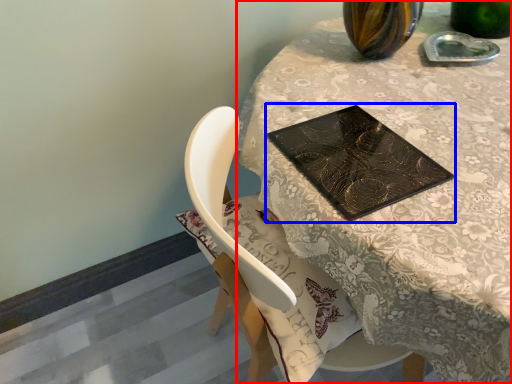
Question: Which point is further to the camera, table (highlighted by a red box) or book cover (highlighted by a blue box)?

Choices:
 (A) table
 (B) book cover

Answer: (B)